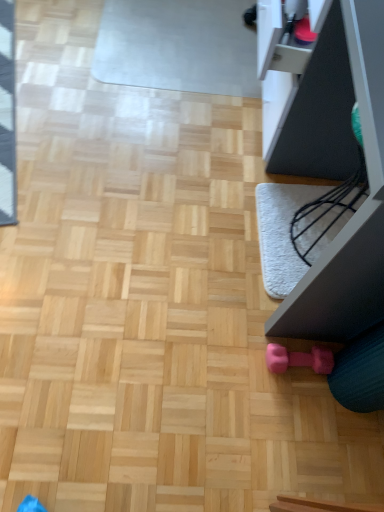
What do you see at coordinates (337, 179) in the screenshot?
I see `matte black monitor at right` at bounding box center [337, 179].

I want to click on matte black monitor at right, so click(337, 179).

Measure the distance between point (357, 156) and camera.

A distance of 1.38 meters exists between point (357, 156) and camera.

Describe the element at coordinates (299, 359) in the screenshot. I see `pink rubber dumbbell at lower right` at that location.

At what (x,y) coordinates should I click in order to perform the action: click on pink rubber dumbbell at lower right. Please return your answer as a coordinate pair (x, y). The width and height of the screenshot is (384, 512). Looking at the image, I should click on (299, 359).

Find the location of a particular element. The width and height of the screenshot is (384, 512). matte black monitor at right is located at coordinates pyautogui.click(x=337, y=179).

Based on the photo, is pink rubber dumbbell at lower right to the left of matte black monitor at right from the viewer's perspective?

Yes, pink rubber dumbbell at lower right is to the left of matte black monitor at right.

Does pink rubber dumbbell at lower right lie behind matte black monitor at right?

Yes, it is behind matte black monitor at right.

Which is in front, point (286, 359) or point (310, 129)?

Positioned in front is point (286, 359).

From the image's perspective, is pink rubber dumbbell at lower right positioned above or below matte black monitor at right?

pink rubber dumbbell at lower right is situated lower than matte black monitor at right in the image.

From a real-world perspective, which object stands above the other?

matte black monitor at right, from a real-world perspective.

Can you confirm if pink rubber dumbbell at lower right is thinner than matte black monitor at right?

Yes, pink rubber dumbbell at lower right is thinner than matte black monitor at right.

Between pink rubber dumbbell at lower right and matte black monitor at right, which one has more height?

matte black monitor at right is taller.

Looking at the image, does pink rubber dumbbell at lower right seem bigger or smaller compared to matte black monitor at right?

Clearly, pink rubber dumbbell at lower right is smaller in size than matte black monitor at right.

Is pink rubber dumbbell at lower right inside or outside of matte black monitor at right?

The correct answer is: outside.

Does pink rubber dumbbell at lower right touch matte black monitor at right?

No.

Does pink rubber dumbbell at lower right turn towards matte black monitor at right?

No, pink rubber dumbbell at lower right is not turned towards matte black monitor at right.

Can you tell me how much pink rubber dumbbell at lower right and matte black monitor at right differ in facing direction?

pink rubber dumbbell at lower right and matte black monitor at right are facing 0.00299 degrees away from each other.

Locate an element on the screen. This screenshot has width=384, height=512. furniture above the pink rubber dumbbell at lower right (from a real-world perspective) is located at coordinates (337, 179).

Considering the relative positions of matte black monitor at right and pink rubber dumbbell at lower right in the image provided, is matte black monitor at right to the left of pink rubber dumbbell at lower right from the viewer's perspective?

No, matte black monitor at right is not to the left of pink rubber dumbbell at lower right.

Is matte black monitor at right in front of or behind pink rubber dumbbell at lower right in the image?

matte black monitor at right is positioned closer to the viewer than pink rubber dumbbell at lower right.

Does point (324, 21) appear closer or farther from the camera than point (306, 362)?

Point (324, 21) is positioned closer to the camera compared to point (306, 362).

From the image's perspective, which one is positioned higher, matte black monitor at right or pink rubber dumbbell at lower right?

matte black monitor at right.

From a real-world perspective, is matte black monitor at right positioned above or below pink rubber dumbbell at lower right?

matte black monitor at right is above pink rubber dumbbell at lower right.

Consider the image. Considering the relative sizes of matte black monitor at right and pink rubber dumbbell at lower right in the image provided, is matte black monitor at right wider than pink rubber dumbbell at lower right?

Yes, matte black monitor at right is wider than pink rubber dumbbell at lower right.

Considering the relative sizes of matte black monitor at right and pink rubber dumbbell at lower right in the image provided, is matte black monitor at right shorter than pink rubber dumbbell at lower right?

No.

Considering the sizes of objects matte black monitor at right and pink rubber dumbbell at lower right in the image provided, who is bigger, matte black monitor at right or pink rubber dumbbell at lower right?

matte black monitor at right.

Is matte black monitor at right spatially inside pink rubber dumbbell at lower right, or outside of it?

matte black monitor at right cannot be found inside pink rubber dumbbell at lower right.

Is matte black monitor at right not near pink rubber dumbbell at lower right?

No.

Is matte black monitor at right positioned with its back to pink rubber dumbbell at lower right?

matte black monitor at right does not have its back to pink rubber dumbbell at lower right.

Can you tell me how much matte black monitor at right and pink rubber dumbbell at lower right differ in facing direction?

There is a 0.00299-degree angle between the facing directions of matte black monitor at right and pink rubber dumbbell at lower right.

You are a GUI agent. You are given a task and a screenshot of the screen. Output one action in this format:
    pyautogui.click(x=<x>, y=<y>)
    Task: Click on the furniture on the right of pink rubber dumbbell at lower right
    The image size is (384, 512).
    Given the screenshot: What is the action you would take?
    pyautogui.click(x=337, y=179)

At what (x,y) coordinates should I click in order to perform the action: click on toy beneath the matte black monitor at right (from a real-world perspective). Please return your answer as a coordinate pair (x, y). Looking at the image, I should click on (299, 359).

The image size is (384, 512). Identify the location of toy that appears behind the matte black monitor at right. (299, 359).